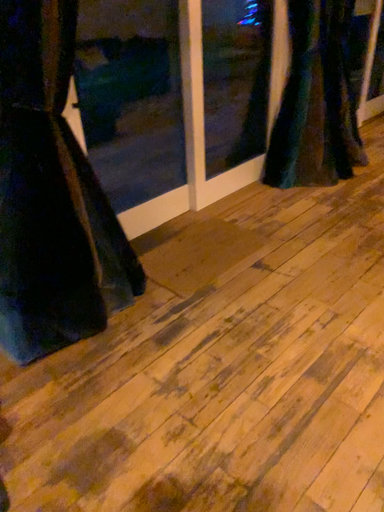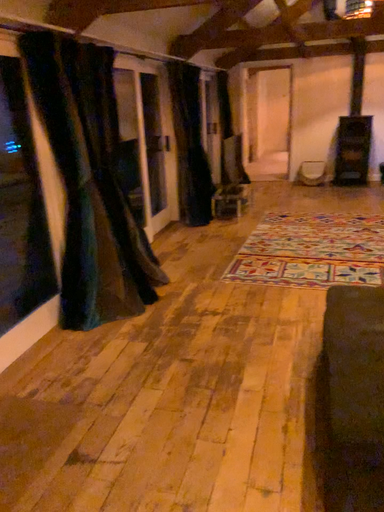
Question: Which way did the camera rotate in the video?

Choices:
 (A) rotated upward
 (B) rotated downward

Answer: (A)